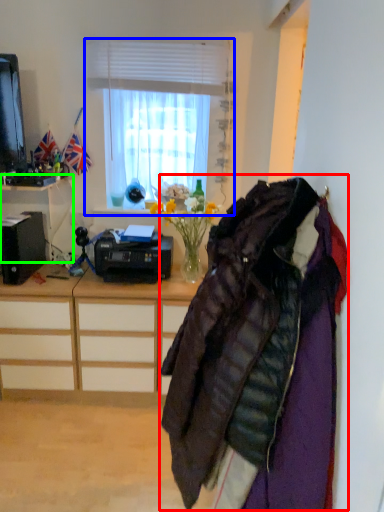
Question: Based on their relative distances, which object is nearer to jacket (highlighted by a red box)? Choose from window (highlighted by a blue box) and desk (highlighted by a green box).

Choices:
 (A) window
 (B) desk

Answer: (A)